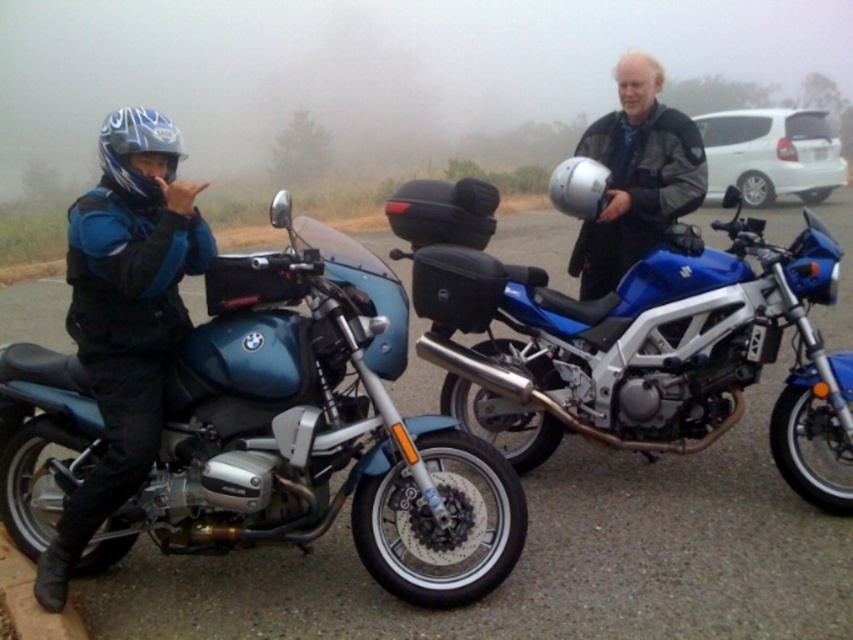
You are planning to take a photo of the two motorcycles. Since you want to capture both in the frame, which motorcycle should you position closer to the camera to ensure the metallic blue motorcycle at left and the matte blue motorcycle at left are both visible?

You should position the metallic blue motorcycle at left closer to the camera because it is located below the matte blue motorcycle at left, so adjusting their positions can help both fit into the frame.

You are a photographer trying to capture both motorcycles in a single frame. Given that your camera has a 16 inch wide lens, can you fit both the metallic blue motorcycle at left and the matte blue motorcycle at left into the frame without moving the camera?

The metallic blue motorcycle at left and matte blue motorcycle at left are 18.13 inches apart. Since the distance between them exceeds the 16 inch width of the lens, you cannot fit both into the frame without moving the camera.